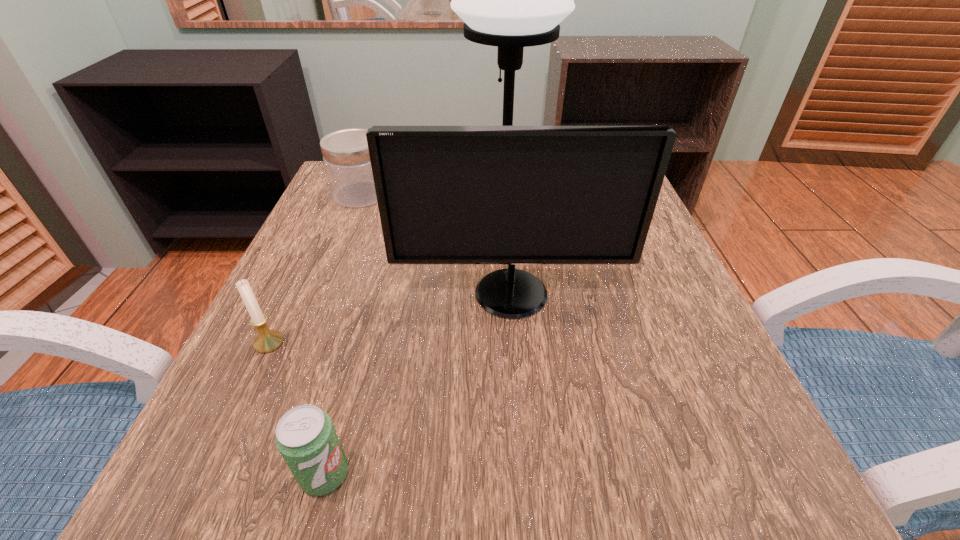
Find the location of a particular element. the third closest object to the soda is located at coordinates (512, 0).